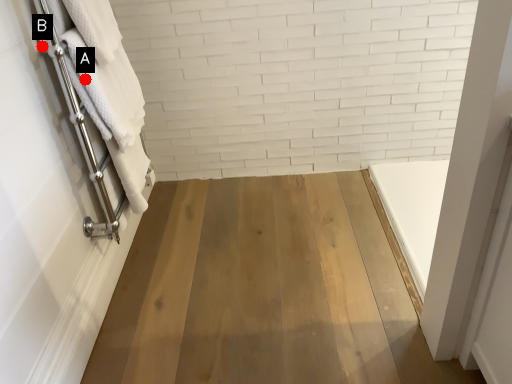
Question: Two points are circled on the image, labeled by A and B beside each circle. Which point appears closest to the camera in this image?

Choices:
 (A) A is closer
 (B) B is closer

Answer: (B)